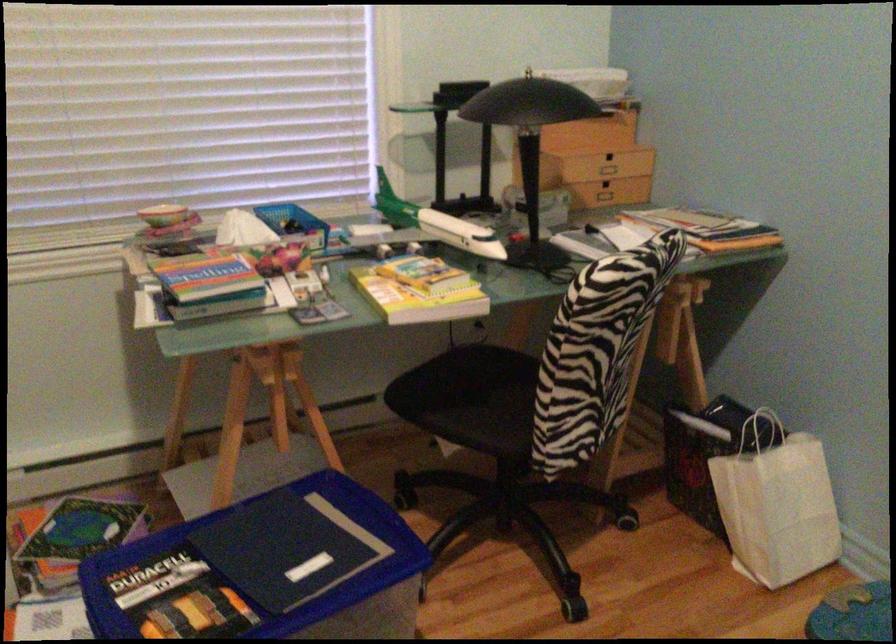
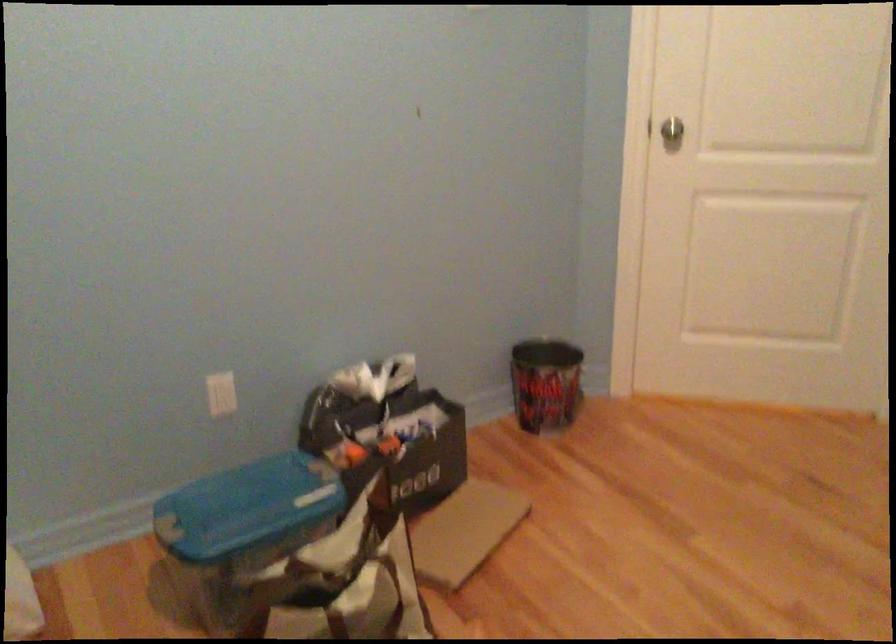
First-person continuous shooting, in which direction is the camera rotating?

The camera rotated toward right-down.